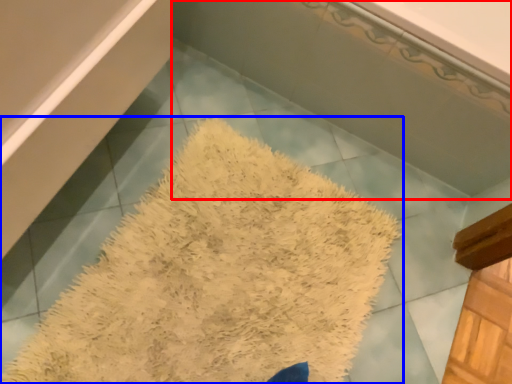
Question: Which of the following is the farthest to the observer, bath (highlighted by a red box) or bath mat (highlighted by a blue box)?

Choices:
 (A) bath
 (B) bath mat

Answer: (A)